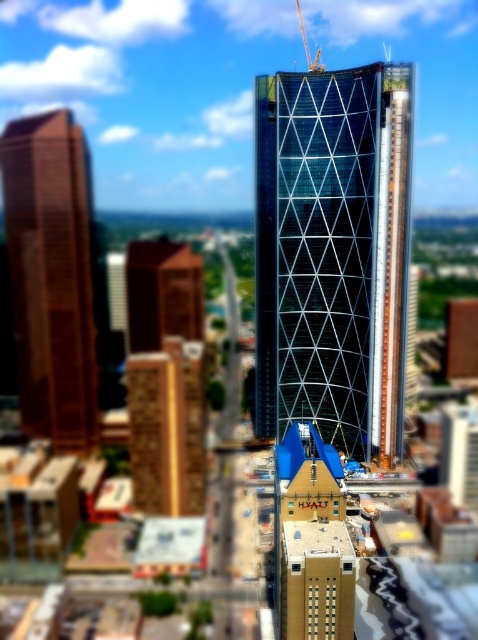
Question: Which of these objects is positioned farthest from the brown wooden tower at center?

Choices:
 (A) brown textured building at center
 (B) brown polished wood tower at left

Answer: (A)

Question: Does glassy steel tower at center have a greater width compared to brown wooden tower at center?

Choices:
 (A) yes
 (B) no

Answer: (A)

Question: Which object is positioned farthest from the yellow metallic crane at center?

Choices:
 (A) glassy steel tower at center
 (B) brown polished wood tower at left

Answer: (B)

Question: Can you confirm if blue glass building at center is positioned below brown wooden tower at center?

Choices:
 (A) no
 (B) yes

Answer: (B)

Question: Can you confirm if brown polished wood tower at left is positioned below brown textured building at center?

Choices:
 (A) yes
 (B) no

Answer: (B)

Question: Which point is farther to the camera?

Choices:
 (A) brown wooden tower at center
 (B) brown polished wood tower at left

Answer: (A)